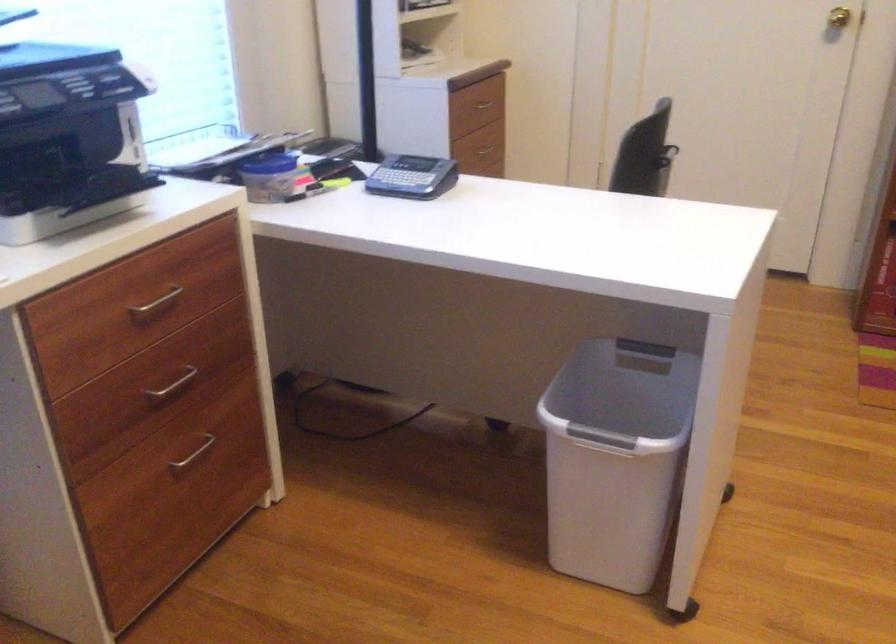
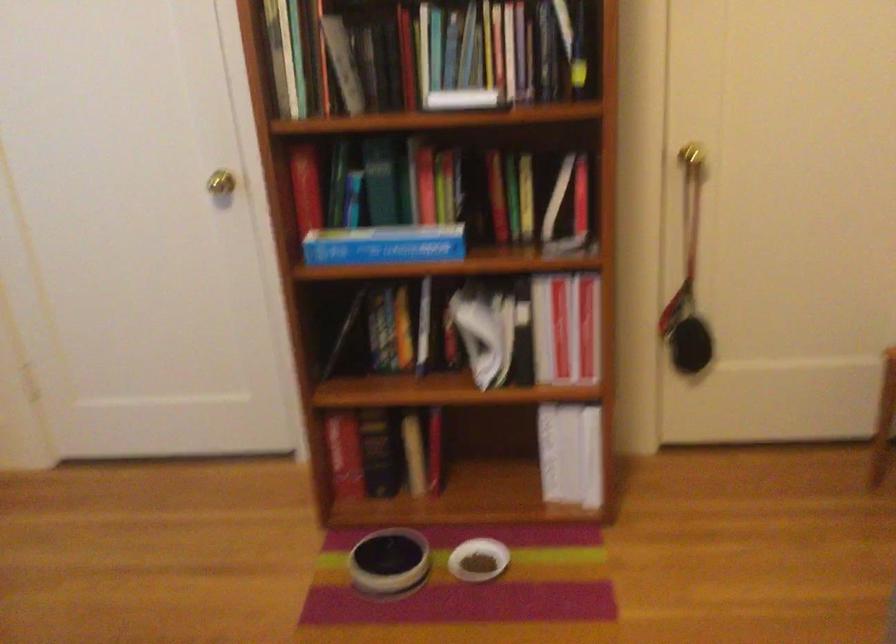
The images are taken continuously from a first-person perspective. In which direction are you moving?

A: The cameraman moved toward right, forward.